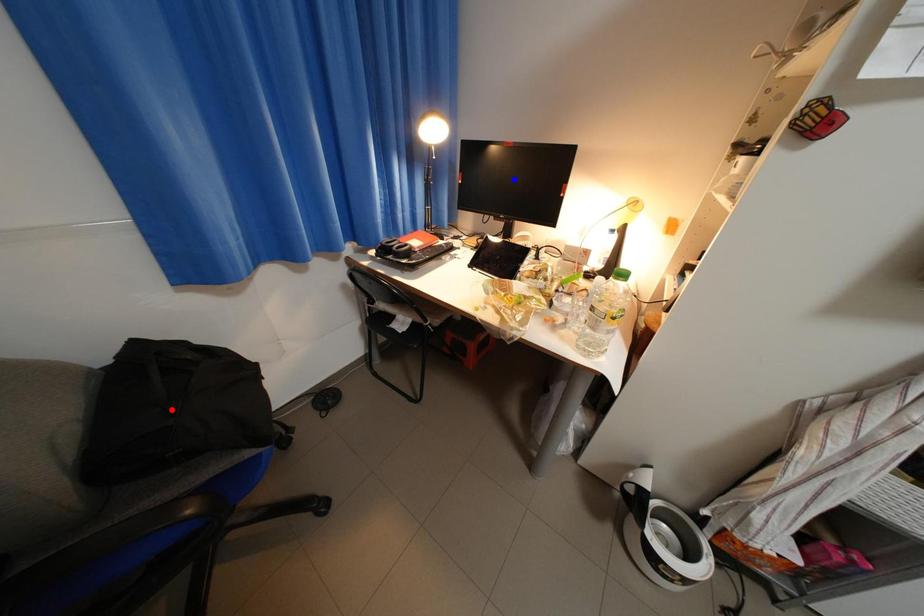
Question: In the image, two points are highlighted. Which point is nearer to the camera? Reply with the corresponding letter.

Choices:
 (A) blue point
 (B) red point

Answer: (B)